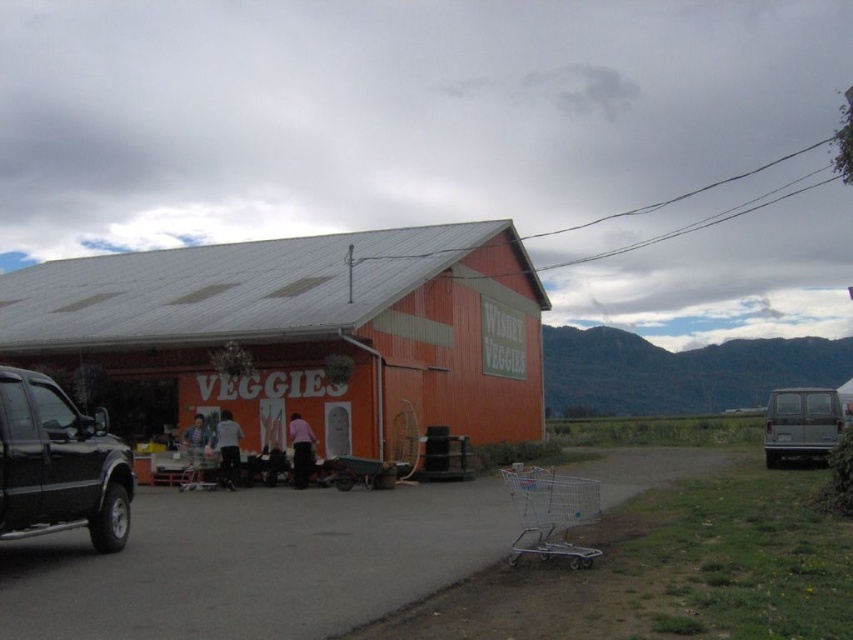
Question: Which point appears closest to the camera in this image?

Choices:
 (A) (590, 557)
 (B) (112, 472)
 (C) (790, 392)

Answer: (A)

Question: Among these points, which one is nearest to the camera?

Choices:
 (A) (508, 483)
 (B) (61, 401)
 (C) (784, 406)
 (D) (196, 292)

Answer: (B)

Question: Does metallic silver shopping cart at lower right appear under gray matte van at right?

Choices:
 (A) no
 (B) yes

Answer: (A)

Question: Which object is closer to the camera taking this photo?

Choices:
 (A) orange corrugated metal barn at center
 (B) gray matte van at right
 (C) metallic silver shopping cart at lower right

Answer: (C)

Question: Is orange corrugated metal barn at center positioned behind black matte truck at left?

Choices:
 (A) yes
 (B) no

Answer: (A)

Question: Can you confirm if orange corrugated metal barn at center is positioned above metallic silver shopping cart at lower right?

Choices:
 (A) no
 (B) yes

Answer: (B)